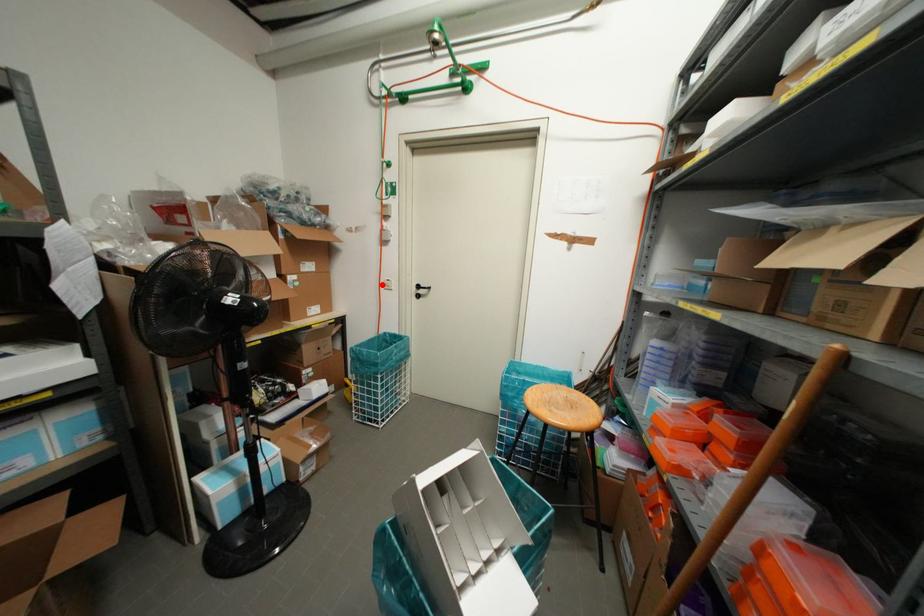
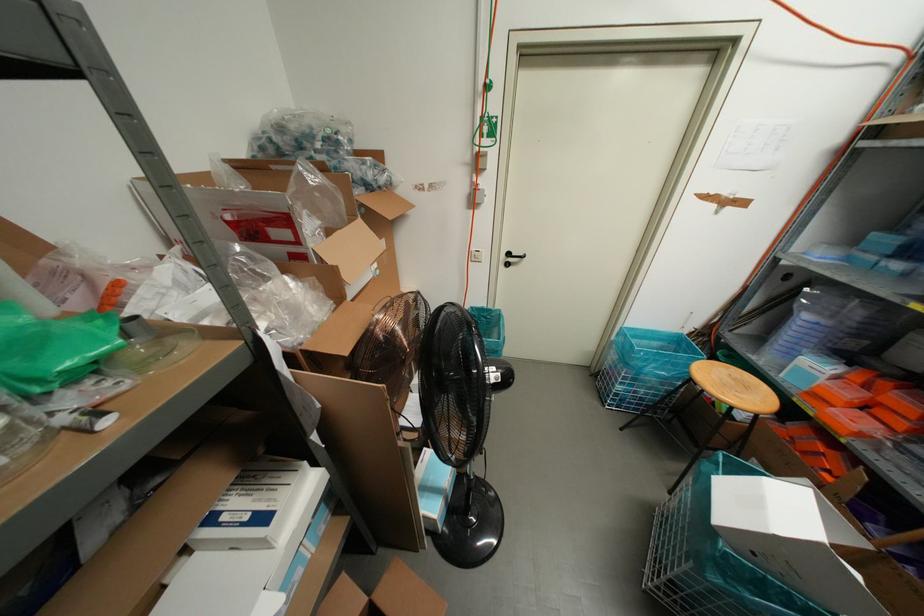
Question: I am providing you with two images of the same scene from different viewpoints. Given a red point in image1, look at the same physical point in image2. Is it:

Choices:
 (A) Closer to the viewpoint
 (B) Farther from the viewpoint

Answer: (A)